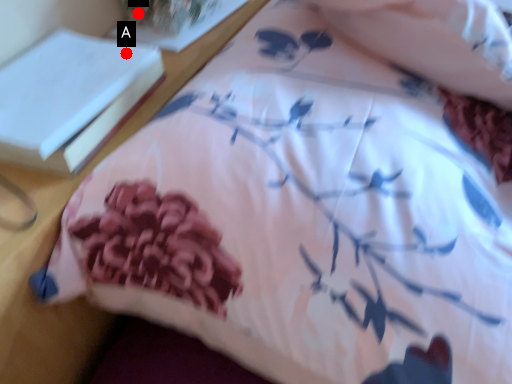
Question: Two points are circled on the image, labeled by A and B beside each circle. Which point appears farthest from the camera in this image?

Choices:
 (A) A is further
 (B) B is further

Answer: (B)